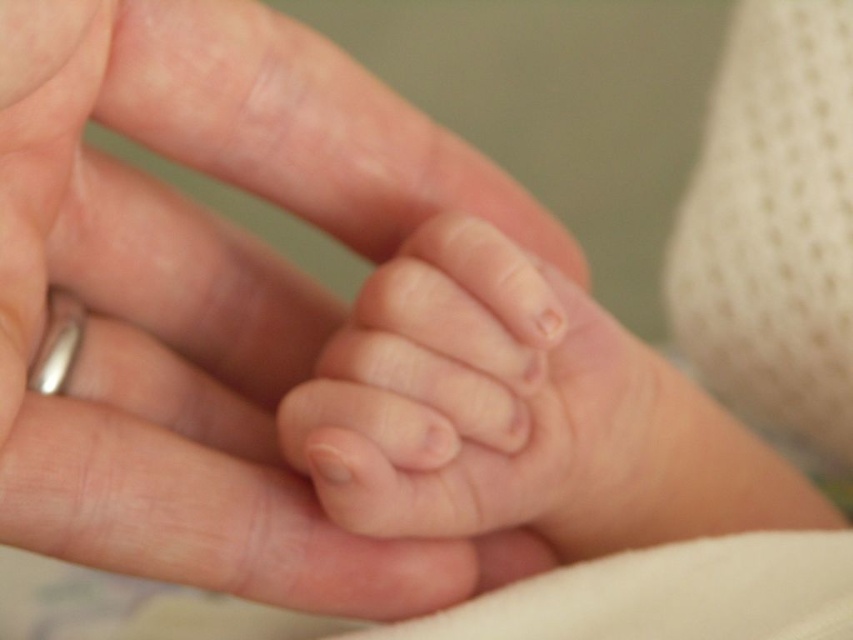
Can you confirm if smooth skin hand at center is wider than smooth skin toe at center?

Indeed, smooth skin hand at center has a greater width compared to smooth skin toe at center.

Does smooth skin hand at center have a lesser width compared to smooth skin toe at center?

Incorrect, smooth skin hand at center's width is not less than smooth skin toe at center's.

Find the location of a particular element. This screenshot has height=640, width=853. smooth skin hand at center is located at coordinates click(209, 296).